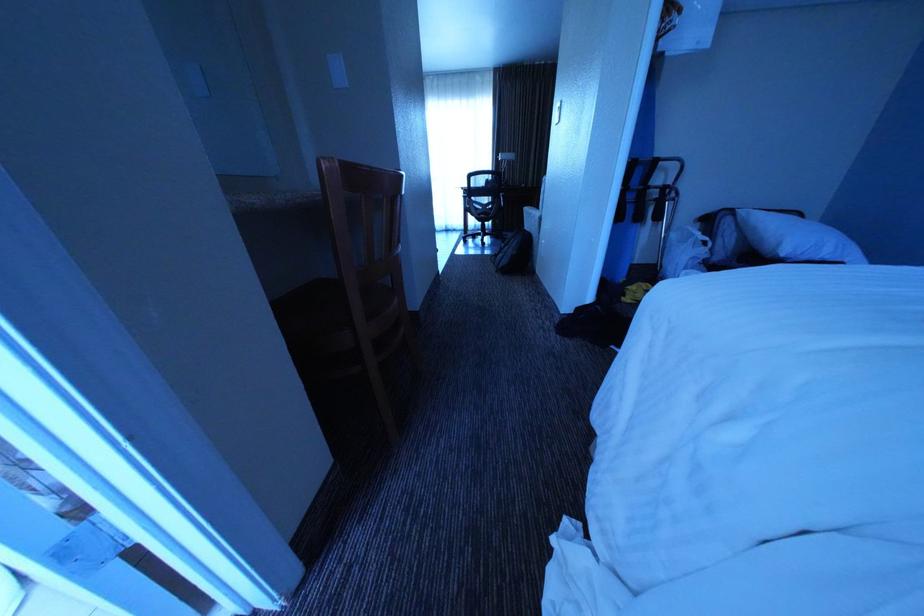
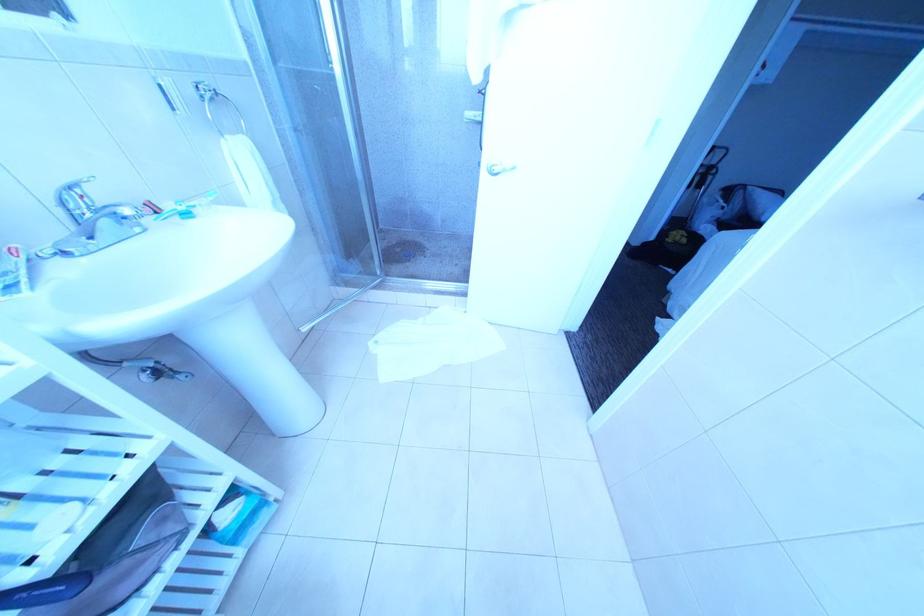
The images are taken continuously from a first-person perspective. In which direction are you moving?

The cameraman walked toward left, backward.